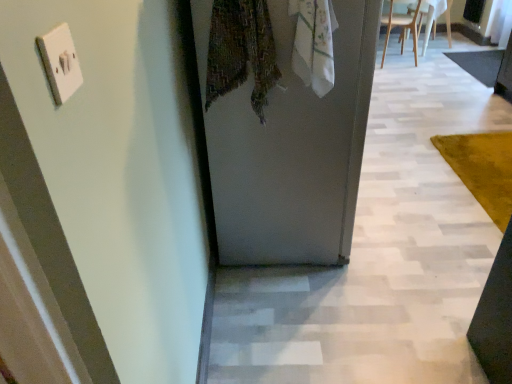
Question: From a real-world perspective, is white plastic chair at upper right, the 2th chair positioned from the left, on top of white matte door at center?

Choices:
 (A) yes
 (B) no

Answer: (B)

Question: From the image's perspective, is white plastic chair at upper right, the first chair positioned from the right, below white matte door at center?

Choices:
 (A) yes
 (B) no

Answer: (B)

Question: Would you say white plastic chair at upper right, the 2th chair positioned from the left, is outside white matte door at center?

Choices:
 (A) no
 (B) yes

Answer: (B)

Question: Is white matte door at center at the back of white plastic chair at upper right, the first chair positioned from the right?

Choices:
 (A) yes
 (B) no

Answer: (B)

Question: Is white plastic chair at upper right, the first chair positioned from the right, not near white matte door at center?

Choices:
 (A) no
 (B) yes

Answer: (B)

Question: From a real-world perspective, relative to white plastic chair at upper right, the first chair positioned from the right, is white wooden chair at upper right, the 2th chair from the right, vertically above or below?

Choices:
 (A) above
 (B) below

Answer: (A)

Question: Visually, is white wooden chair at upper right, which is counted as the 1th chair, starting from the left, positioned to the left or to the right of white plastic chair at upper right, the 2th chair positioned from the left?

Choices:
 (A) left
 (B) right

Answer: (A)

Question: In terms of height, does white wooden chair at upper right, the 2th chair from the right, look taller or shorter compared to white plastic chair at upper right, the first chair positioned from the right?

Choices:
 (A) short
 (B) tall

Answer: (B)

Question: In terms of width, does white wooden chair at upper right, the 2th chair from the right, look wider or thinner when compared to white plastic chair at upper right, the first chair positioned from the right?

Choices:
 (A) wide
 (B) thin

Answer: (A)

Question: Is dark gray carpet at right, the first mat viewed from the right, taller or shorter than white plastic switch at upper left?

Choices:
 (A) tall
 (B) short

Answer: (B)

Question: Is dark gray carpet at right, positioned as the 2th mat in front-to-back order, to the left or to the right of white plastic switch at upper left in the image?

Choices:
 (A) right
 (B) left

Answer: (A)

Question: Looking at the image, does dark gray carpet at right, the 2th mat when ordered from left to right, seem bigger or smaller compared to white plastic switch at upper left?

Choices:
 (A) big
 (B) small

Answer: (A)

Question: Is point (490, 69) positioned closer to the camera than point (68, 31)?

Choices:
 (A) farther
 (B) closer

Answer: (A)

Question: In terms of size, does white cotton scarf at upper center appear bigger or smaller than white plastic switch at upper left?

Choices:
 (A) small
 (B) big

Answer: (B)

Question: From the image's perspective, is white cotton scarf at upper center positioned above or below white plastic switch at upper left?

Choices:
 (A) below
 (B) above

Answer: (B)